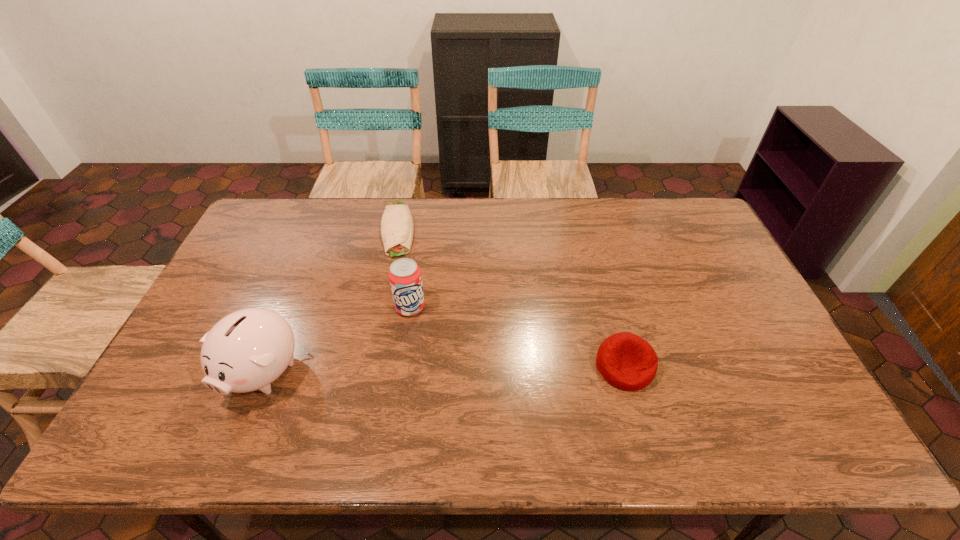
In the image, there is a desktop. In order to click on free space at the far edge in this screenshot , I will do `click(611, 239)`.

At what (x,y) coordinates should I click in order to perform the action: click on vacant position at the near edge of the desktop. Please return your answer as a coordinate pair (x, y). Looking at the image, I should click on (477, 390).

Image resolution: width=960 pixels, height=540 pixels. In order to click on vacant space at the left edge of the desktop in this screenshot , I will do `click(207, 301)`.

You are a GUI agent. You are given a task and a screenshot of the screen. Output one action in this format:
    pyautogui.click(x=<x>, y=<y>)
    Task: Click on the free space at the right edge of the desktop
    This screenshot has width=960, height=540.
    Given the screenshot: What is the action you would take?
    pyautogui.click(x=760, y=370)

At what (x,y) coordinates should I click in order to perform the action: click on free space at the far left corner of the desktop. Please return your answer as a coordinate pair (x, y). This screenshot has height=540, width=960. Looking at the image, I should click on (267, 218).

You are a GUI agent. You are given a task and a screenshot of the screen. Output one action in this format:
    pyautogui.click(x=<x>, y=<y>)
    Task: Click on the free spot at the near left corner of the desktop
    
    Given the screenshot: What is the action you would take?
    pyautogui.click(x=151, y=405)

Locate an element on the screen. This screenshot has height=540, width=960. vacant area that lies between the tallest object and the third shortest object is located at coordinates (337, 339).

The height and width of the screenshot is (540, 960). In order to click on unoccupied area between the burrito and the tallest object in this screenshot , I will do `click(330, 300)`.

At what (x,y) coordinates should I click in order to perform the action: click on free space between the leftmost object and the third tallest object. Please return your answer as a coordinate pair (x, y). Looking at the image, I should click on (444, 369).

This screenshot has width=960, height=540. What are the coordinates of `free spot between the rightmost object and the piggy bank` in the screenshot? It's located at (444, 369).